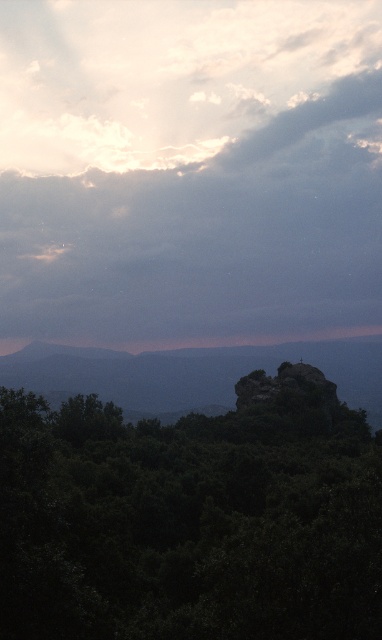
Is cloudy sky at upper center below green leafy tree at center?

No.

Is point (71, 33) more distant than point (32, 540)?

Yes, point (71, 33) is behind point (32, 540).

Image resolution: width=382 pixels, height=640 pixels. What do you see at coordinates (189, 172) in the screenshot?
I see `cloudy sky at upper center` at bounding box center [189, 172].

The height and width of the screenshot is (640, 382). Identify the location of cloudy sky at upper center. (189, 172).

Is cloudy sky at upper center to the left of rugged stone peak at center from the viewer's perspective?

Indeed, cloudy sky at upper center is positioned on the left side of rugged stone peak at center.

Describe the element at coordinates (189, 172) in the screenshot. I see `cloudy sky at upper center` at that location.

Locate an element on the screen. This screenshot has height=640, width=382. cloudy sky at upper center is located at coordinates (189, 172).

Which of these two, green leafy tree at center or rugged stone peak at center, stands shorter?

Standing shorter between the two is rugged stone peak at center.

Is point (276, 481) farther from camera compared to point (299, 400)?

That is False.

Between point (378, 515) and point (330, 404), which one is positioned in front?

Point (378, 515)

Image resolution: width=382 pixels, height=640 pixels. What are the coordinates of `green leafy tree at center` in the screenshot? It's located at (192, 516).